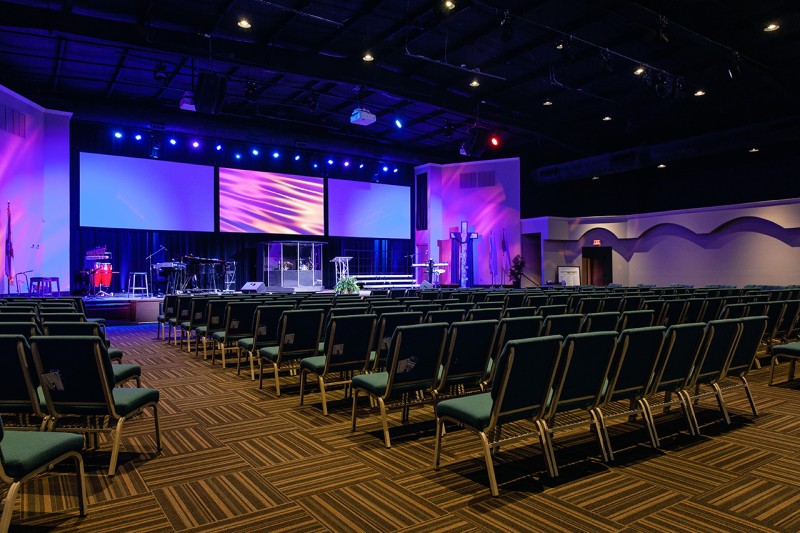
Identify the location of chair. This screenshot has height=533, width=800. (546, 384).